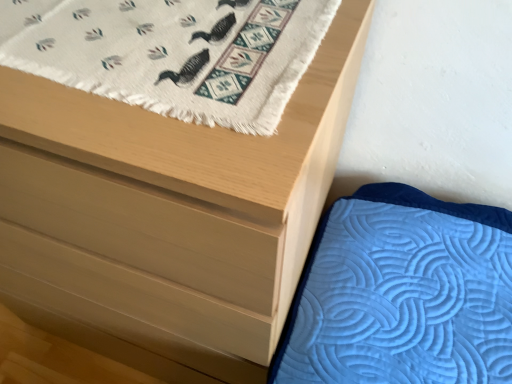
Question: Is matte wood chest of drawers at upper left positioned with its back to white woven rug with duck pattern at upper left?

Choices:
 (A) yes
 (B) no

Answer: (B)

Question: From the image's perspective, is matte wood chest of drawers at upper left beneath white woven rug with duck pattern at upper left?

Choices:
 (A) no
 (B) yes

Answer: (B)

Question: From the image's perspective, is matte wood chest of drawers at upper left over white woven rug with duck pattern at upper left?

Choices:
 (A) no
 (B) yes

Answer: (A)

Question: Would you say matte wood chest of drawers at upper left is a long distance from white woven rug with duck pattern at upper left?

Choices:
 (A) no
 (B) yes

Answer: (A)

Question: Considering the relative sizes of matte wood chest of drawers at upper left and white woven rug with duck pattern at upper left in the image provided, is matte wood chest of drawers at upper left wider than white woven rug with duck pattern at upper left?

Choices:
 (A) yes
 (B) no

Answer: (A)

Question: Is matte wood chest of drawers at upper left at the left side of white woven rug with duck pattern at upper left?

Choices:
 (A) no
 (B) yes

Answer: (B)

Question: Considering the relative positions of white woven rug with duck pattern at upper left and matte wood chest of drawers at upper left in the image provided, is white woven rug with duck pattern at upper left behind matte wood chest of drawers at upper left?

Choices:
 (A) yes
 (B) no

Answer: (A)

Question: Is white woven rug with duck pattern at upper left in contact with matte wood chest of drawers at upper left?

Choices:
 (A) yes
 (B) no

Answer: (B)

Question: Is white woven rug with duck pattern at upper left shorter than matte wood chest of drawers at upper left?

Choices:
 (A) no
 (B) yes

Answer: (B)

Question: Is matte wood chest of drawers at upper left at the back of white woven rug with duck pattern at upper left?

Choices:
 (A) yes
 (B) no

Answer: (A)

Question: From the image's perspective, would you say white woven rug with duck pattern at upper left is shown under matte wood chest of drawers at upper left?

Choices:
 (A) no
 (B) yes

Answer: (A)

Question: Is white woven rug with duck pattern at upper left bigger than matte wood chest of drawers at upper left?

Choices:
 (A) yes
 (B) no

Answer: (B)

Question: Considering the positions of point (146, 82) and point (276, 288), is point (146, 82) closer or farther from the camera than point (276, 288)?

Choices:
 (A) farther
 (B) closer

Answer: (B)